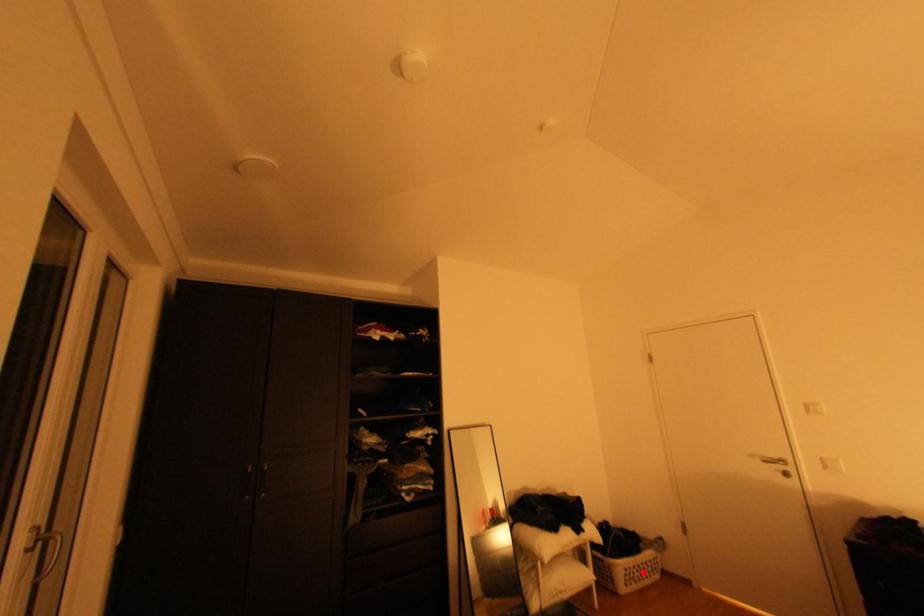
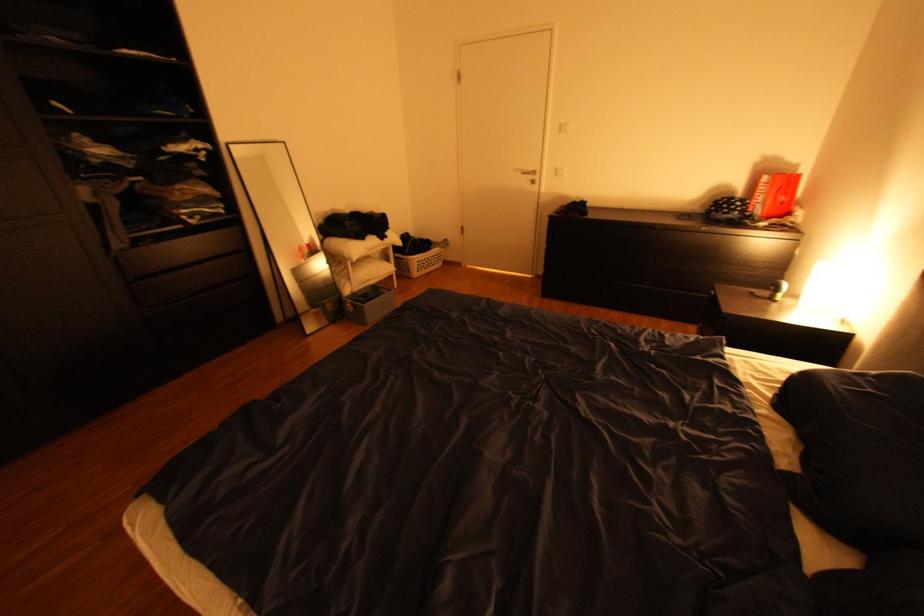
Find the pixel in the second image that matches the highlighted location in the first image.

(433, 264)